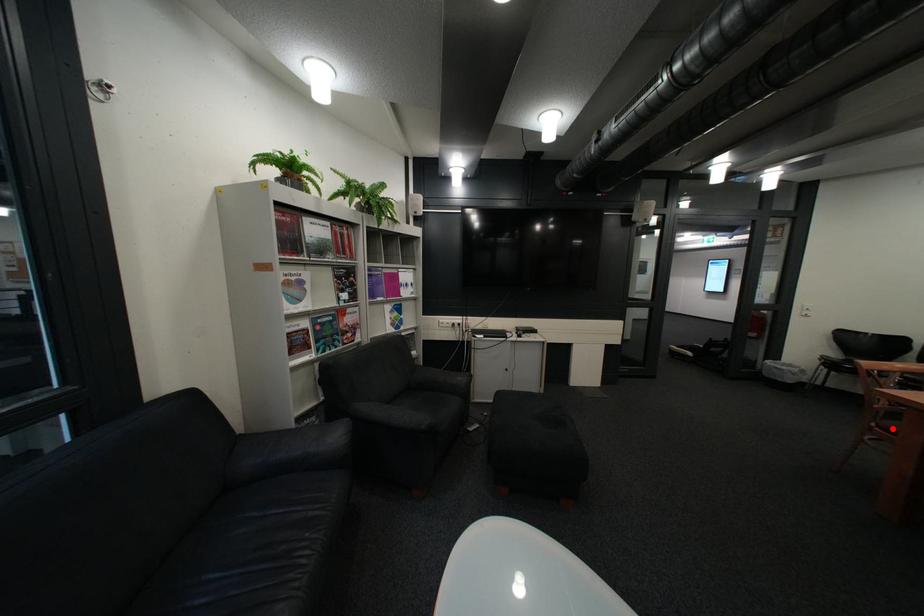
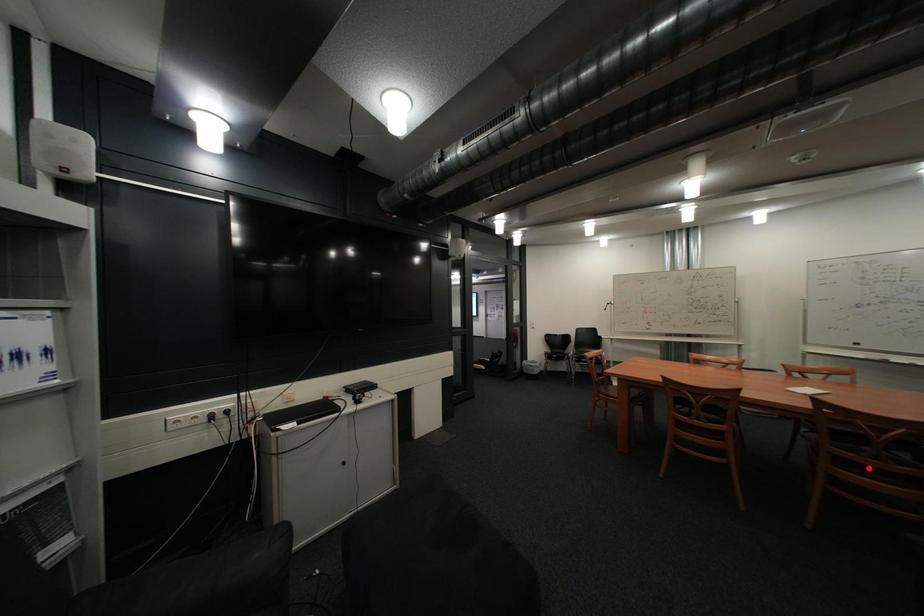
I am providing you with two images of the same scene from different viewpoints. A red point is marked on the first image and another point is marked on the second image. Do the highlighted points in image1 and image2 indicate the same real-world spot?

No